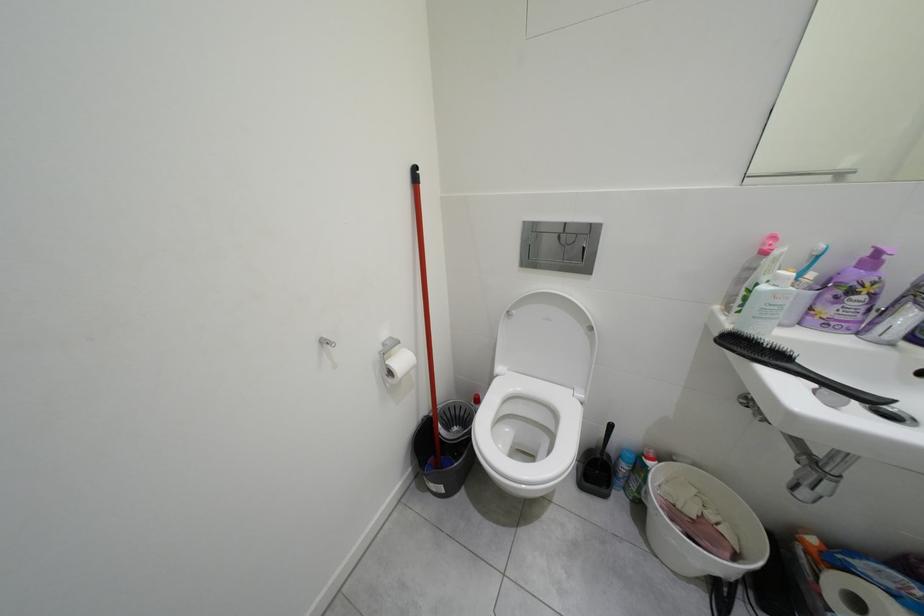
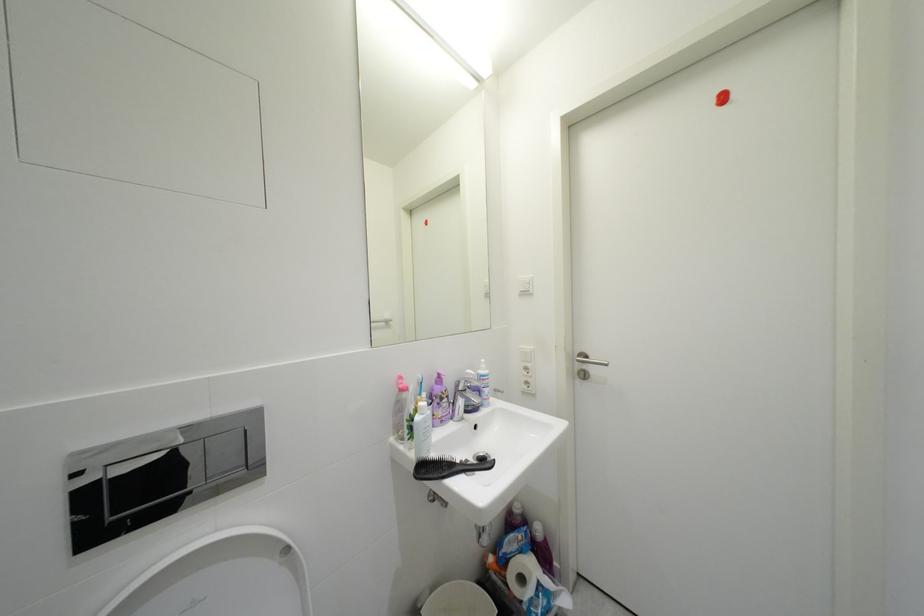
Question: The camera is either moving clockwise (left) or counter-clockwise (right) around the object. The first image is from the beginning of the video and the second image is from the end. Is the camera moving left or right when shooting the video?

Choices:
 (A) Left
 (B) Right

Answer: (A)